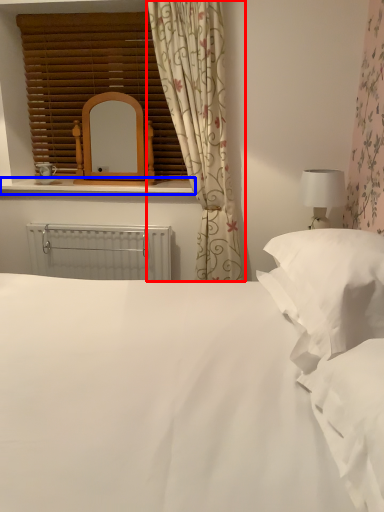
Question: Which object appears farthest to the camera in this image, curtain (highlighted by a red box) or window sill (highlighted by a blue box)?

Choices:
 (A) curtain
 (B) window sill

Answer: (B)